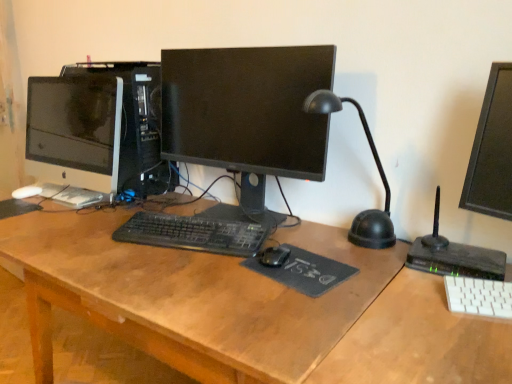
Locate an element on the screen. free point behind black matte keyboard at center, the first computer keyboard positioned from the left is located at coordinates (179, 202).